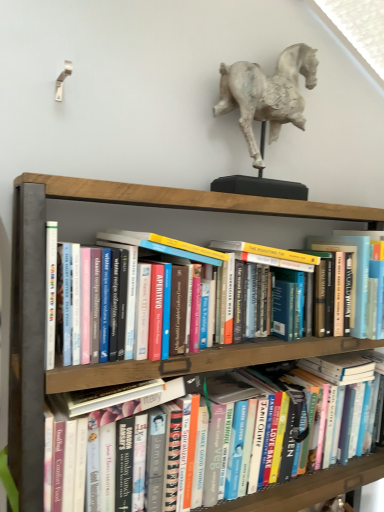
Question: From a real-world perspective, does hardcover book at center stand above white plaster horse at upper center?

Choices:
 (A) yes
 (B) no

Answer: (B)

Question: From a real-world perspective, is hardcover book at center located beneath white plaster horse at upper center?

Choices:
 (A) no
 (B) yes

Answer: (B)

Question: Can you confirm if hardcover book at center is thinner than white plaster horse at upper center?

Choices:
 (A) no
 (B) yes

Answer: (A)

Question: Is hardcover book at center looking in the opposite direction of white plaster horse at upper center?

Choices:
 (A) yes
 (B) no

Answer: (B)

Question: Can white plaster horse at upper center be found inside hardcover book at center?

Choices:
 (A) yes
 (B) no

Answer: (B)

Question: Considering the relative sizes of hardcover book at center and white plaster horse at upper center in the image provided, is hardcover book at center taller than white plaster horse at upper center?

Choices:
 (A) yes
 (B) no

Answer: (B)

Question: Is wooden bookshelf at center shorter than hardcover book at center?

Choices:
 (A) yes
 (B) no

Answer: (B)

Question: Does wooden bookshelf at center come in front of hardcover book at center?

Choices:
 (A) no
 (B) yes

Answer: (B)

Question: Is wooden bookshelf at center facing towards hardcover book at center?

Choices:
 (A) yes
 (B) no

Answer: (A)

Question: Is the depth of wooden bookshelf at center greater than that of hardcover book at center?

Choices:
 (A) yes
 (B) no

Answer: (B)

Question: From the image's perspective, does wooden bookshelf at center appear lower than hardcover book at center?

Choices:
 (A) yes
 (B) no

Answer: (B)

Question: Does wooden bookshelf at center have a greater height compared to hardcover book at center?

Choices:
 (A) no
 (B) yes

Answer: (B)

Question: From a real-world perspective, is white plaster horse at upper center positioned under wooden bookshelf at center based on gravity?

Choices:
 (A) yes
 (B) no

Answer: (B)